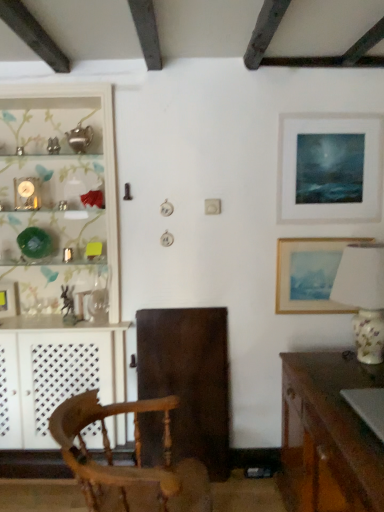
Question: From the image's perspective, is wooden picture frame at right, acting as the 2th picture frame starting from the top, positioned above or below porcelain floral lamp at right?

Choices:
 (A) above
 (B) below

Answer: (A)

Question: In terms of size, does wooden picture frame at right, the second picture frame in the left-to-right sequence, appear bigger or smaller than porcelain floral lamp at right?

Choices:
 (A) small
 (B) big

Answer: (A)

Question: Which object is the farthest from the wooden picture frame at right, acting as the 2th picture frame starting from the top?

Choices:
 (A) matte white picture frame at upper right, which is counted as the 3th picture frame, starting from the bottom
 (B) wooden desk at lower right
 (C) porcelain floral lamp at right
 (D) wooden chair at center
 (E) metallic rectangular frame at left, positioned as the third picture frame in right-to-left order

Answer: (E)

Question: Which of these objects is positioned farthest from the matte glass shelf at left?

Choices:
 (A) porcelain floral lamp at right
 (B) wooden desk at lower right
 (C) wooden picture frame at right, acting as the 2th picture frame starting from the top
 (D) metallic rectangular frame at left, positioned as the third picture frame in top-to-bottom order
 (E) matte white picture frame at upper right, the 1th picture frame viewed from the right

Answer: (A)